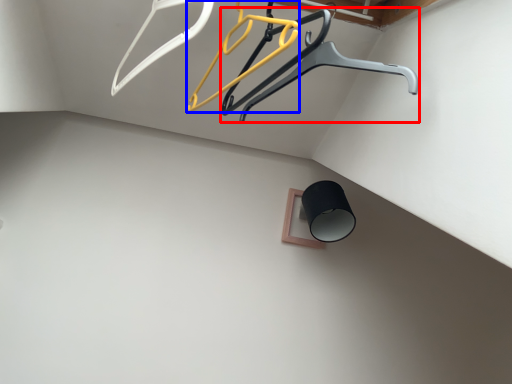
Question: Which point is closer to the camera, furniture (highlighted by a red box) or hanger (highlighted by a blue box)?

Choices:
 (A) furniture
 (B) hanger

Answer: (B)